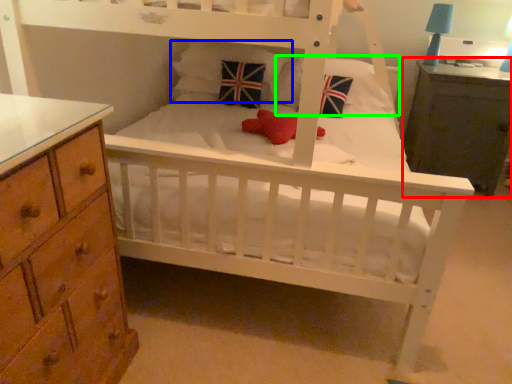
Question: Based on their relative distances, which object is farther from nightstand (highlighted by a red box)? Choose from pillow (highlighted by a blue box) and pillow (highlighted by a green box).

Choices:
 (A) pillow
 (B) pillow

Answer: (A)